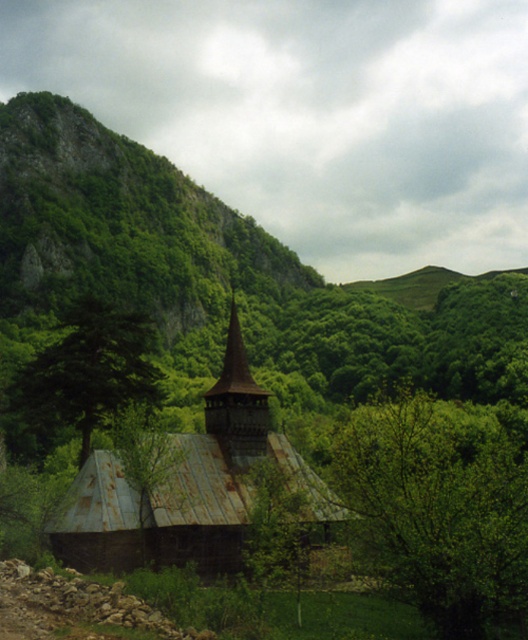
You are standing at the entrance of the weathered wooden building with a steeply pitched roof. You want to walk directly towards the green leafy tree at center. Which direction should you head in from the building?

The green leafy tree at center is located at point coordinates, so you should head in the direction of the coordinates from the building.